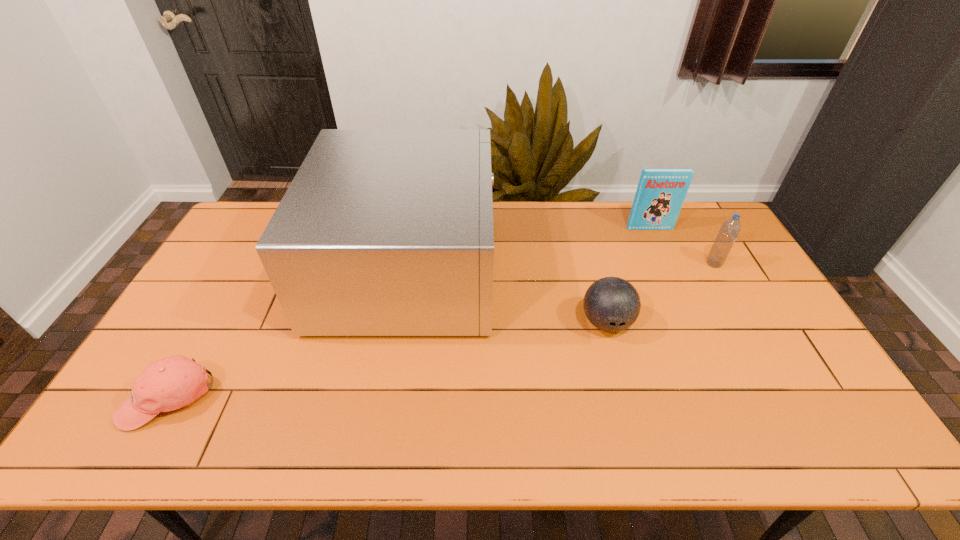
The height and width of the screenshot is (540, 960). Find the location of `object located at the near left corner`. object located at the near left corner is located at coordinates (167, 384).

Where is `vacant position at the near edge of the desktop`? The width and height of the screenshot is (960, 540). vacant position at the near edge of the desktop is located at coordinates (600, 451).

In the image, there is a desktop. Where is `vacant space at the left edge`? vacant space at the left edge is located at coordinates (232, 285).

What are the coordinates of `blank area at the right edge` in the screenshot? It's located at (796, 352).

Locate an element on the screen. This screenshot has width=960, height=540. free point at the far right corner is located at coordinates (692, 205).

The width and height of the screenshot is (960, 540). What are the coordinates of `free spot between the third object from right to left and the tallest object` in the screenshot? It's located at (508, 295).

Where is `empty space between the second shortest object and the baseball cap`? This screenshot has width=960, height=540. empty space between the second shortest object and the baseball cap is located at coordinates (388, 360).

Find the location of a particular element. vacant point located between the third tallest object and the fourth shortest object is located at coordinates (682, 246).

Where is `empty location between the book and the tallest object`? Image resolution: width=960 pixels, height=540 pixels. empty location between the book and the tallest object is located at coordinates (529, 248).

The height and width of the screenshot is (540, 960). In order to click on unoccupied position between the rightmost object and the microwave oven in this screenshot , I will do `click(562, 266)`.